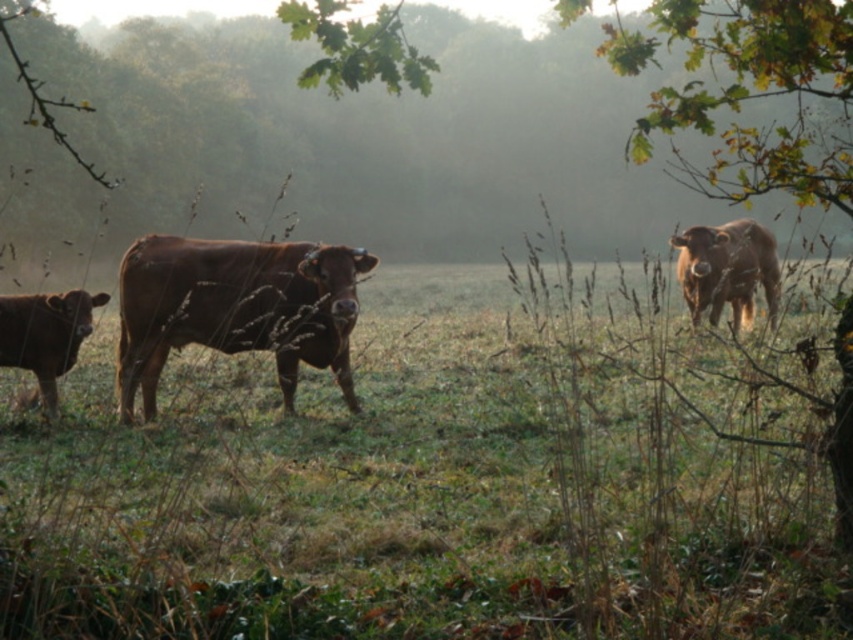
Is brown grassy at center smaller than shiny brown bull at lower left?

No, brown grassy at center is not smaller than shiny brown bull at lower left.

Is brown grassy at center thinner than shiny brown bull at lower left?

No.

Which is behind, point (651, 449) or point (47, 392)?

The point (47, 392) is behind.

Where is `brown grassy at center`? The width and height of the screenshot is (853, 640). brown grassy at center is located at coordinates point(442,483).

Which is more to the left, brown grassy at center or brown matte cow at center?

From the viewer's perspective, brown matte cow at center appears more on the left side.

Looking at this image, who is taller, brown grassy at center or brown matte cow at center?

Standing taller between the two is brown grassy at center.

This screenshot has height=640, width=853. I want to click on brown grassy at center, so click(442, 483).

Does brown matte cow at center have a greater width compared to brown matte cow at right?

Yes.

Measure the distance between point [141,285] and camera.

A distance of 7.77 meters exists between point [141,285] and camera.

Find the location of a particular element. brown matte cow at center is located at coordinates (235, 307).

Locate an element on the screen. This screenshot has width=853, height=640. brown matte cow at center is located at coordinates (235, 307).